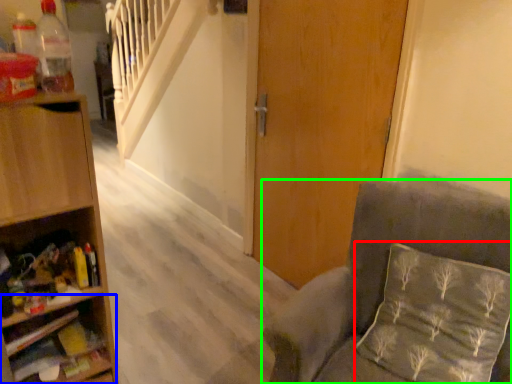
Question: Which object is positioned farthest from pillow (highlighted by a red box)? Select from shelf (highlighted by a blue box) and chair (highlighted by a green box).

Choices:
 (A) shelf
 (B) chair

Answer: (A)